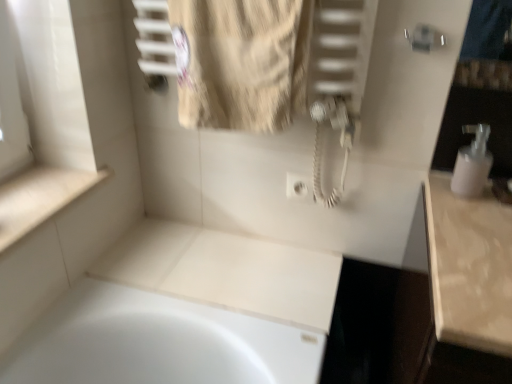
Question: From a real-world perspective, is beige textured towel at upper center under white plastic soap dispenser at right?

Choices:
 (A) yes
 (B) no

Answer: (B)

Question: Can you confirm if beige textured towel at upper center is taller than white plastic soap dispenser at right?

Choices:
 (A) no
 (B) yes

Answer: (B)

Question: From a real-world perspective, does beige textured towel at upper center stand above white plastic soap dispenser at right?

Choices:
 (A) yes
 (B) no

Answer: (A)

Question: Is beige textured towel at upper center not within white plastic soap dispenser at right?

Choices:
 (A) no
 (B) yes

Answer: (B)

Question: Considering the relative positions of beige textured towel at upper center and white plastic soap dispenser at right in the image provided, is beige textured towel at upper center behind white plastic soap dispenser at right?

Choices:
 (A) yes
 (B) no

Answer: (B)

Question: Does beige textured towel at upper center lie in front of white plastic soap dispenser at right?

Choices:
 (A) yes
 (B) no

Answer: (A)

Question: Does white glossy counter top at lower left have a lesser height compared to beige textured towel at upper center?

Choices:
 (A) no
 (B) yes

Answer: (B)

Question: From the image's perspective, is white glossy counter top at lower left located beneath beige textured towel at upper center?

Choices:
 (A) no
 (B) yes

Answer: (B)

Question: Considering the relative positions of white glossy counter top at lower left and beige textured towel at upper center in the image provided, is white glossy counter top at lower left in front of beige textured towel at upper center?

Choices:
 (A) no
 (B) yes

Answer: (A)

Question: Is white glossy counter top at lower left outside of beige textured towel at upper center?

Choices:
 (A) no
 (B) yes

Answer: (B)

Question: Is white glossy counter top at lower left positioned behind beige textured towel at upper center?

Choices:
 (A) yes
 (B) no

Answer: (A)

Question: Does white glossy counter top at lower left have a lesser width compared to beige textured towel at upper center?

Choices:
 (A) no
 (B) yes

Answer: (A)

Question: Is white plastic soap dispenser at right in front of beige textured towel at upper center?

Choices:
 (A) yes
 (B) no

Answer: (B)